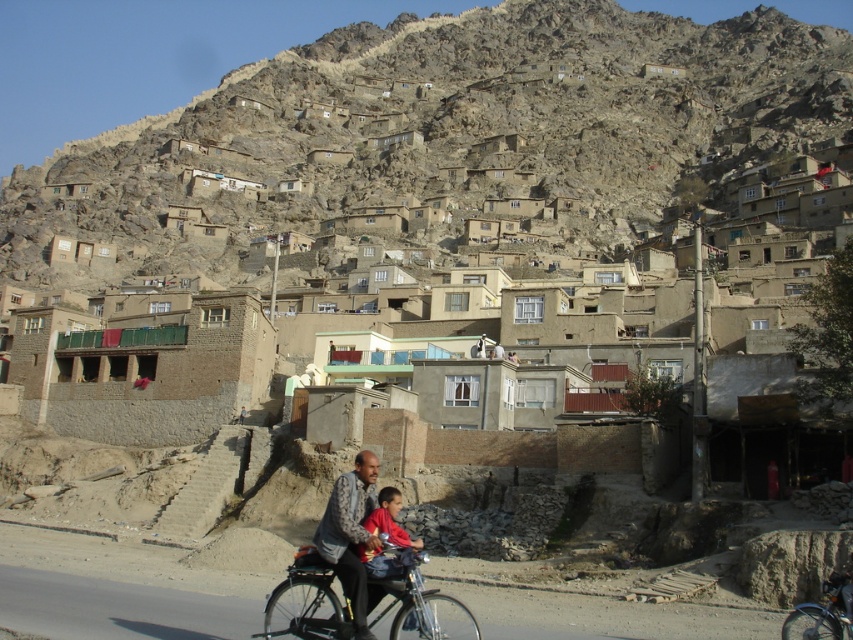
Question: Is patterned fabric shirt at center to the right of silver metallic bicycle at lower right from the viewer's perspective?

Choices:
 (A) no
 (B) yes

Answer: (A)

Question: Can you confirm if rugged stone mountain at upper center is bigger than red cotton shirt at center?

Choices:
 (A) no
 (B) yes

Answer: (B)

Question: Estimate the real-world distances between objects in this image. Which object is farther from the silver metallic bicycle at lower right?

Choices:
 (A) red cotton shirt at center
 (B) rugged stone mountain at upper center

Answer: (B)

Question: Is rugged stone mountain at upper center smaller than patterned fabric shirt at center?

Choices:
 (A) no
 (B) yes

Answer: (A)

Question: Considering the real-world distances, which object is closest to the metallic bicycle at center?

Choices:
 (A) rugged stone mountain at upper center
 (B) red cotton shirt at center
 (C) patterned fabric shirt at center
 (D) silver metallic bicycle at lower right

Answer: (B)

Question: Which object is the closest to the red cotton shirt at center?

Choices:
 (A) silver metallic bicycle at lower right
 (B) metallic bicycle at center
 (C) rugged stone mountain at upper center

Answer: (B)